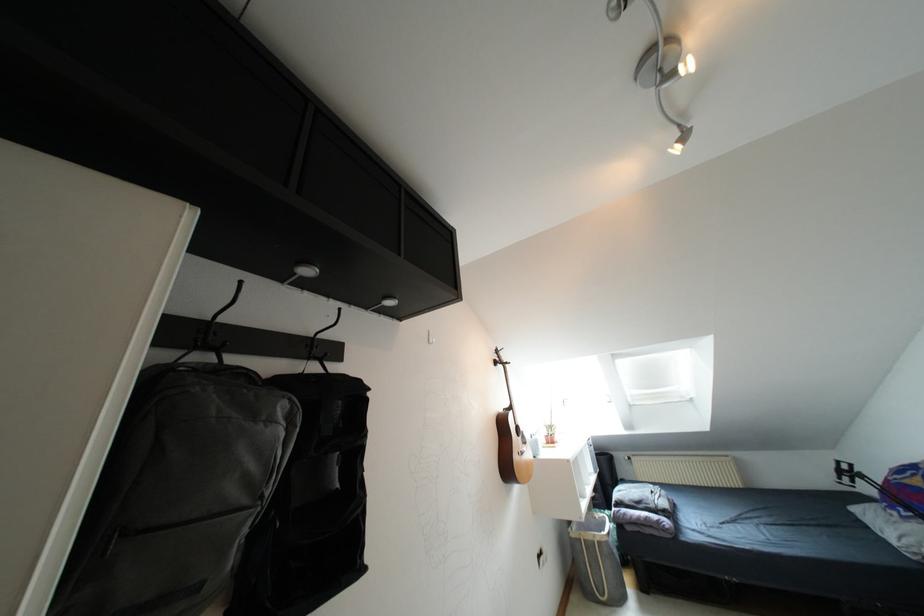
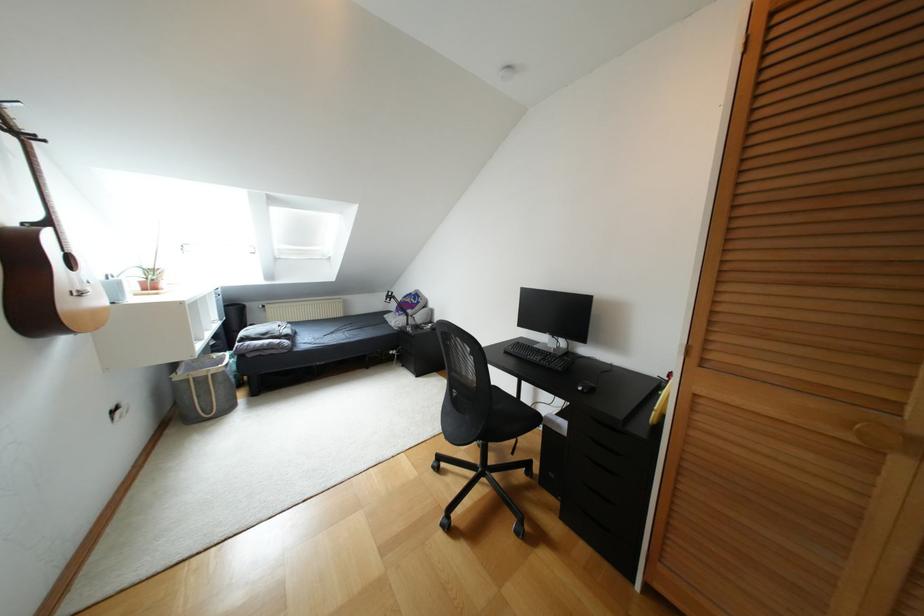
Question: The camera is either moving clockwise (left) or counter-clockwise (right) around the object. The first image is from the beginning of the video and the second image is from the end. Is the camera moving left or right when shooting the video?

Choices:
 (A) Left
 (B) Right

Answer: (A)